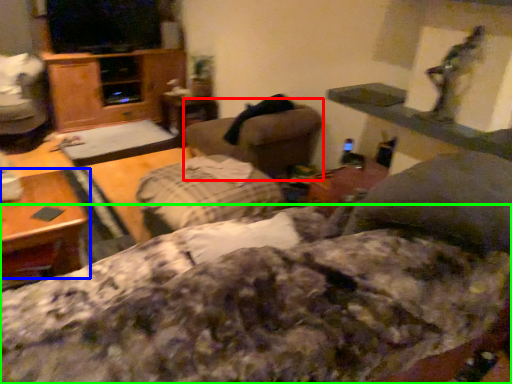
Question: Based on their relative distances, which object is nearer to swivel chair (highlighted by a red box)? Choose from table (highlighted by a blue box) and bedding (highlighted by a green box).

Choices:
 (A) table
 (B) bedding

Answer: (A)